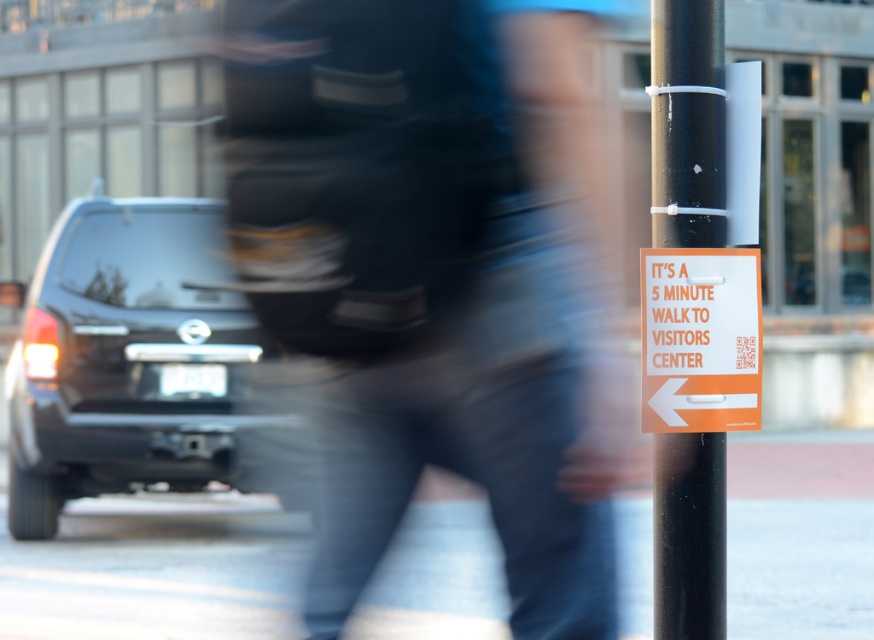
Question: Estimate the real-world distances between objects in this image. Which object is farther from the orange matte sign at center?

Choices:
 (A) black metal pole at center
 (B) black matte suv at left
 (C) smooth concrete pavement at center

Answer: (B)

Question: Which point is farther to the camera?

Choices:
 (A) smooth concrete pavement at center
 (B) orange matte sign at center
 (C) black metal pole at center

Answer: (A)

Question: Considering the relative positions of smooth concrete pavement at center and black metal pole at center in the image provided, where is smooth concrete pavement at center located with respect to black metal pole at center?

Choices:
 (A) above
 (B) below

Answer: (B)

Question: Among these objects, which one is nearest to the camera?

Choices:
 (A) smooth concrete pavement at center
 (B) black metal pole at center

Answer: (B)

Question: Can you confirm if black metal pole at center is positioned below orange matte sign at center?

Choices:
 (A) no
 (B) yes

Answer: (A)

Question: Does smooth concrete pavement at center appear on the right side of black metal pole at center?

Choices:
 (A) yes
 (B) no

Answer: (B)